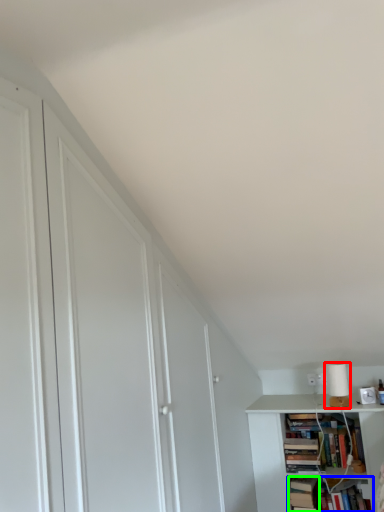
Question: Which object is the farthest from lamp (highlighted by a red box)? Choose among these: book (highlighted by a blue box) or book (highlighted by a green box).

Choices:
 (A) book
 (B) book

Answer: (B)